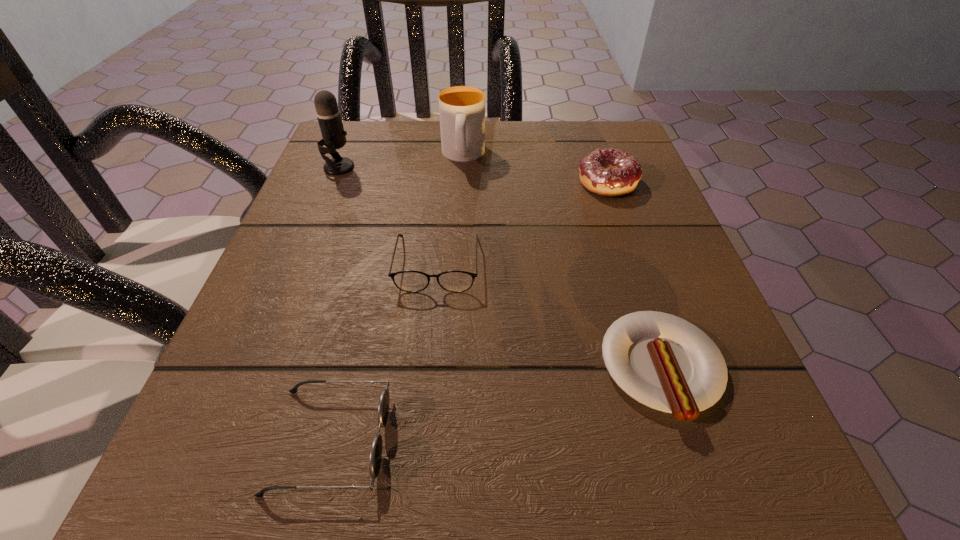
Find the location of a particular element. This screenshot has width=960, height=540. free space located on the front-facing side of the third nearest object is located at coordinates (414, 514).

Where is `free location located 0.240m on the front-facing side of the sunglasses`? This screenshot has width=960, height=540. free location located 0.240m on the front-facing side of the sunglasses is located at coordinates (597, 440).

Find the location of a particular element. This screenshot has width=960, height=540. vacant space located on the back of the sausage is located at coordinates (635, 287).

What are the coordinates of `microphone that is at the far edge` in the screenshot? It's located at (328, 114).

The width and height of the screenshot is (960, 540). Identify the location of cup that is at the far edge. (461, 108).

The width and height of the screenshot is (960, 540). In order to click on doughnut at the far edge in this screenshot , I will do `click(608, 172)`.

Identify the location of object located in the near edge section of the desktop. This screenshot has width=960, height=540. (375, 458).

Find the location of a particular element. microphone present at the left edge is located at coordinates (328, 114).

Find the location of `sunglasses present at the left edge`. sunglasses present at the left edge is located at coordinates (375, 458).

Locate an element on the screen. doughnut that is at the right edge is located at coordinates (608, 172).